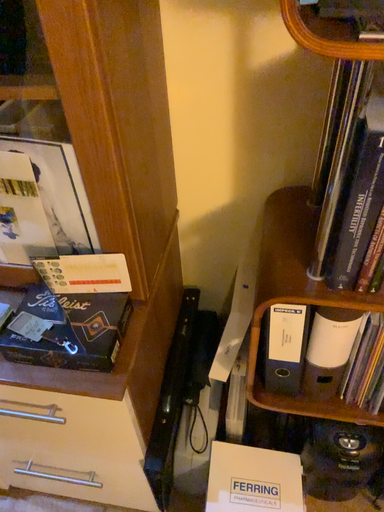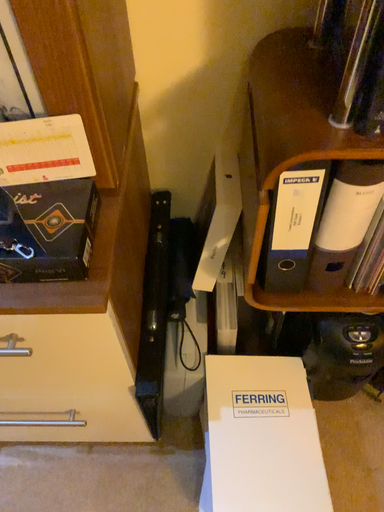
Question: Which way did the camera rotate in the video?

Choices:
 (A) rotated right
 (B) rotated left

Answer: (A)